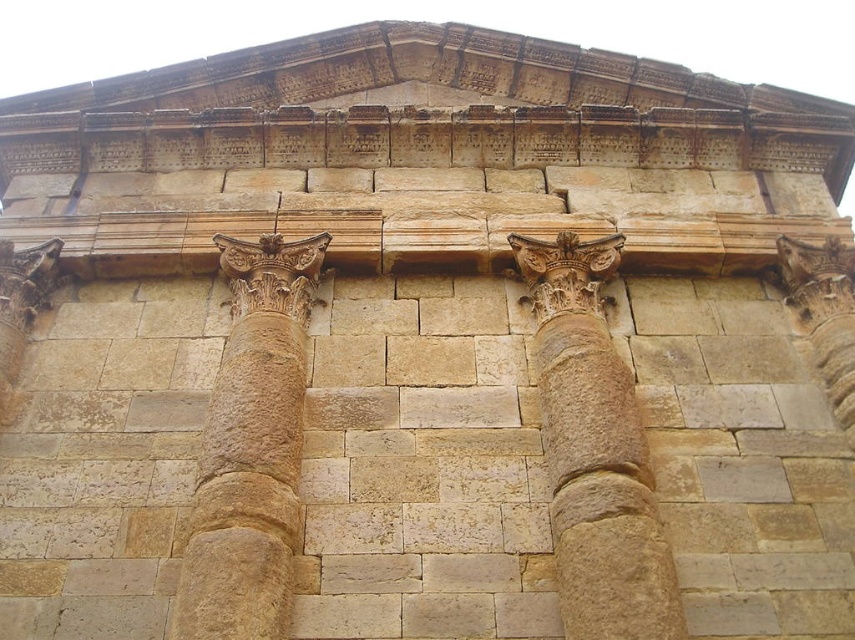
Is beige stone column at center wider than brown stone column at center?

In fact, beige stone column at center might be narrower than brown stone column at center.

Is beige stone column at center taller than brown stone column at center?

Incorrect, beige stone column at center's height is not larger of brown stone column at center's.

Between point (552, 477) and point (239, 259), which one is positioned in front?

Point (552, 477) is more forward.

Identify the location of beige stone column at center. (594, 451).